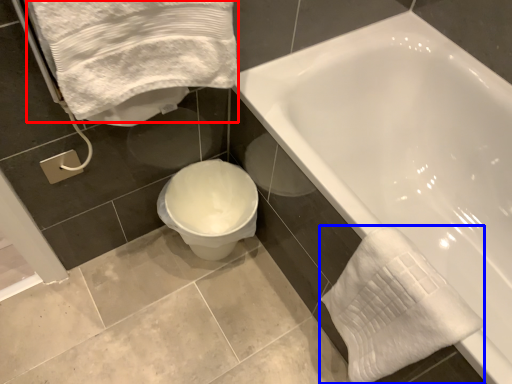
Question: Which of the following is the closest to the observer, bath towel (highlighted by a red box) or bath towel (highlighted by a blue box)?

Choices:
 (A) bath towel
 (B) bath towel

Answer: (A)